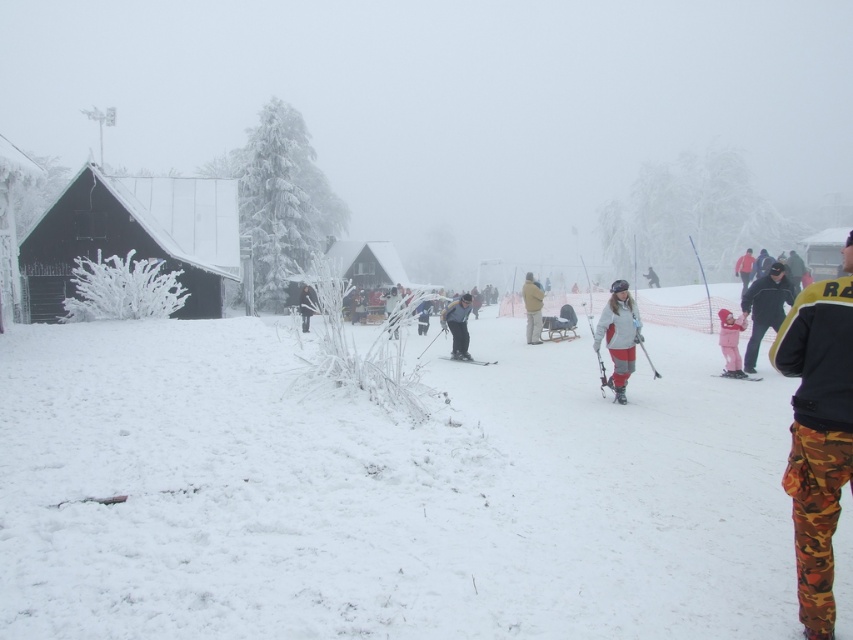
Based on the photo, you are planning to take a photo of the pink fabric snowsuit at center and camouflage pants at center in the snowy scene. Which object should you focus on first if you want to capture both in the same frame without moving the camera?

The pink fabric snowsuit at center is below camouflage pants at center, so you should focus on the camouflage pants at center first to ensure both are in the frame.

You are navigating through the snowy area and need to reach the cabin. There are two points marked on your map at coordinates point [550,372] and point [740,276]. Which point should you pass through first to get closer to the cabin?

You should pass through point [550,372] first because it is in front of point [740,276], meaning it is closer to the cabin.